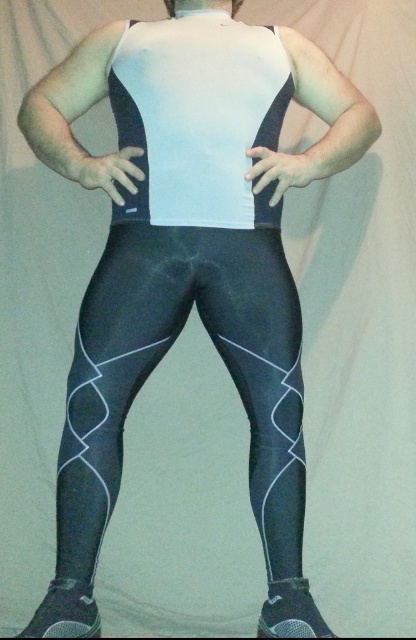
The width and height of the screenshot is (416, 640). Find the location of `black spandex leggings at center`. black spandex leggings at center is located at coordinates (160, 358).

Can you confirm if black spandex leggings at center is shorter than white matte vest at center?

Incorrect, black spandex leggings at center's height does not fall short of white matte vest at center's.

Describe the element at coordinates (160, 358) in the screenshot. The image size is (416, 640). I see `black spandex leggings at center` at that location.

Find the location of a particular element. black spandex leggings at center is located at coordinates (160, 358).